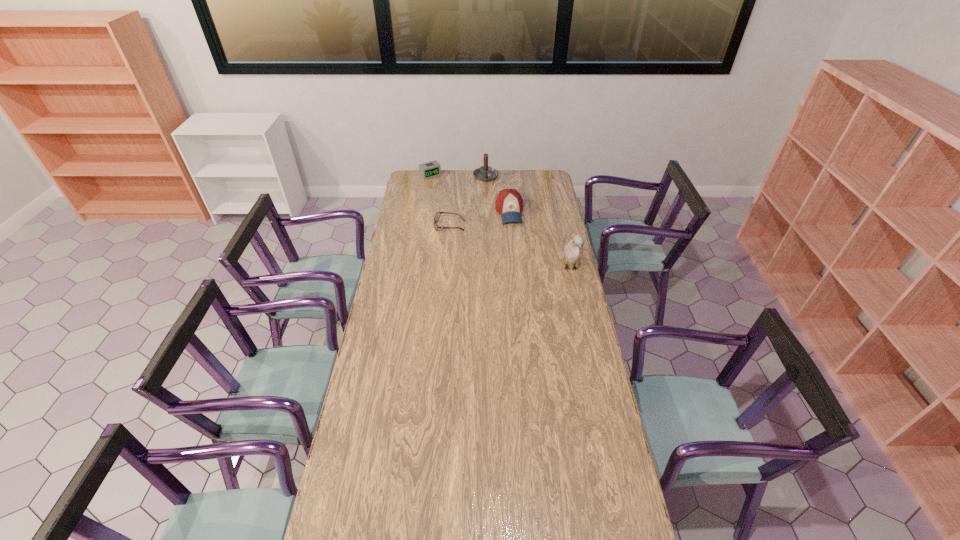
In order to click on free spot on the desktop that is between the shortest object and the tallest object and is positioned on the side of the candle with the handle loop in this screenshot , I will do `click(516, 249)`.

You are a GUI agent. You are given a task and a screenshot of the screen. Output one action in this format:
    pyautogui.click(x=<x>, y=<y>)
    Task: Click on the free space on the desktop that is between the sunglasses and the nearest object and is positioned on the front-facing side of the baseball cap
    
    Given the screenshot: What is the action you would take?
    pyautogui.click(x=517, y=250)

Identify the location of vacant space on the desktop that is between the sunglasses and the bird and is positioned on the front-facing side of the alarm clock. (492, 241).